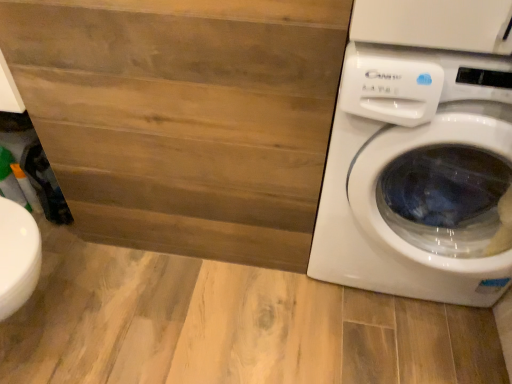
Describe the element at coordinates (421, 154) in the screenshot. Image resolution: width=512 pixels, height=384 pixels. I see `white glossy washing machine at right` at that location.

Find the location of a particular element. This screenshot has width=512, height=384. white glossy washing machine at right is located at coordinates (421, 154).

At what (x,y) coordinates should I click in order to perform the action: click on white glossy washing machine at right. Please return your answer as a coordinate pair (x, y). This screenshot has height=384, width=512. Looking at the image, I should click on (421, 154).